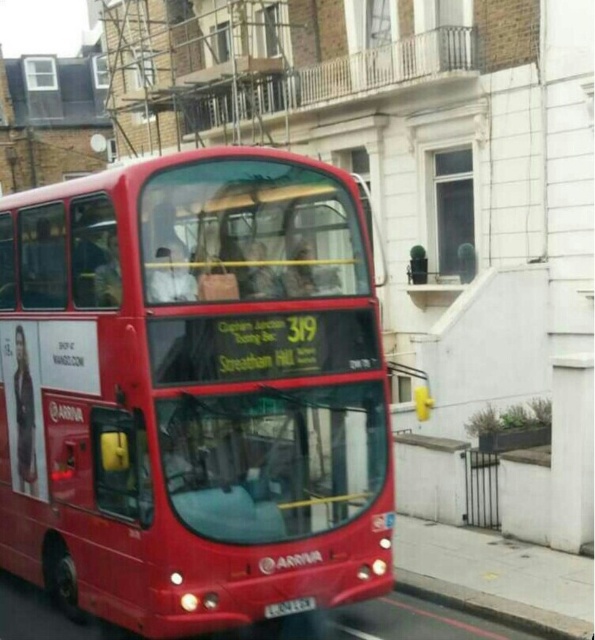
Who is more distant from viewer, (48, 378) or (441, 604)?

The point (441, 604) is behind.

Who is more forward, [349,225] or [519,621]?

Point [349,225] is in front.

The height and width of the screenshot is (640, 595). I want to click on shiny red bus at center, so click(193, 392).

Is gray concrete curb at lower right wider than black plastic license plate at center?

Yes.

Is gray concrete curb at lower right closer to camera compared to black plastic license plate at center?

No, gray concrete curb at lower right is behind black plastic license plate at center.

You are a GUI agent. You are given a task and a screenshot of the screen. Output one action in this format:
    pyautogui.click(x=<x>, y=<y>)
    Task: Click on the gray concrete curb at lower right
    Image resolution: width=595 pixels, height=640 pixels.
    Given the screenshot: What is the action you would take?
    click(493, 608)

Is shiny red bus at center closer to camera compared to black plastic license plate at center?

Yes, it is.

The height and width of the screenshot is (640, 595). What are the coordinates of `shiny red bus at center` in the screenshot? It's located at 193,392.

Does point (361, 493) lie in front of point (308, 605)?

No, it is not.

What are the coordinates of `shiny red bus at center` in the screenshot? It's located at point(193,392).